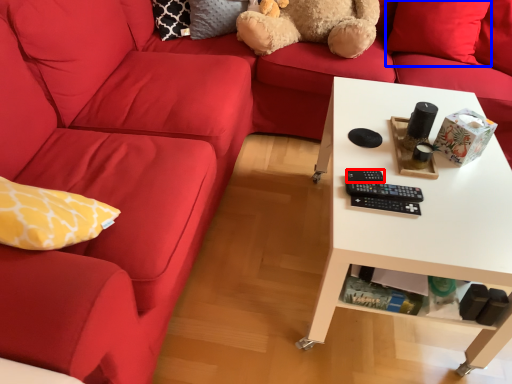
Question: Among these objects, which one is farthest to the camera, control (highlighted by a red box) or pillow (highlighted by a blue box)?

Choices:
 (A) control
 (B) pillow

Answer: (B)